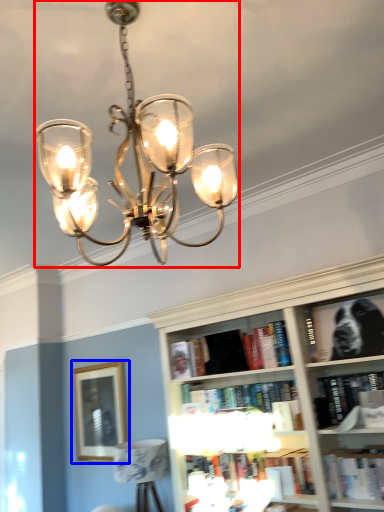
Question: Which object appears closest to the camera in this image, lamp (highlighted by a red box) or picture frame (highlighted by a blue box)?

Choices:
 (A) lamp
 (B) picture frame

Answer: (A)